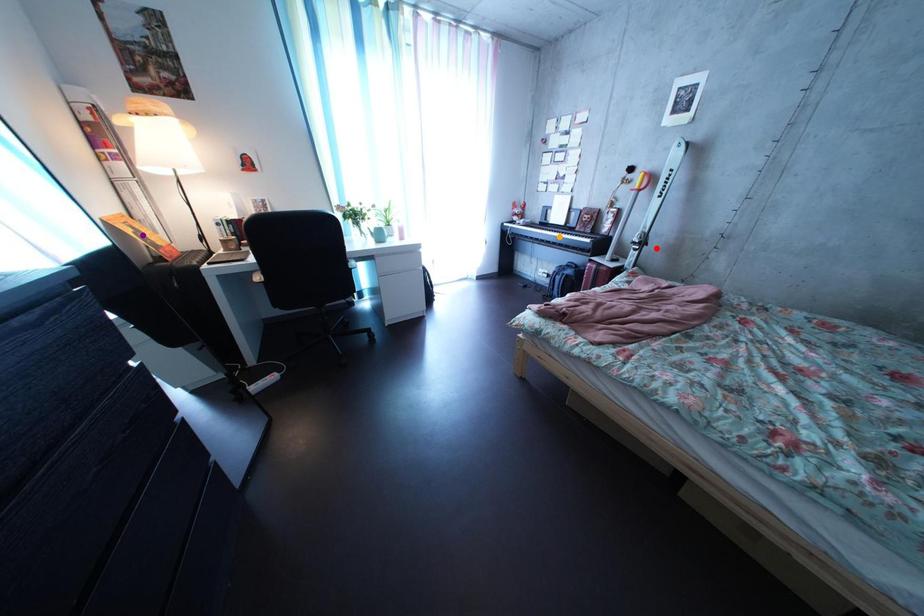
Order these from nearest to farthest:
orange point
red point
purple point

purple point
red point
orange point